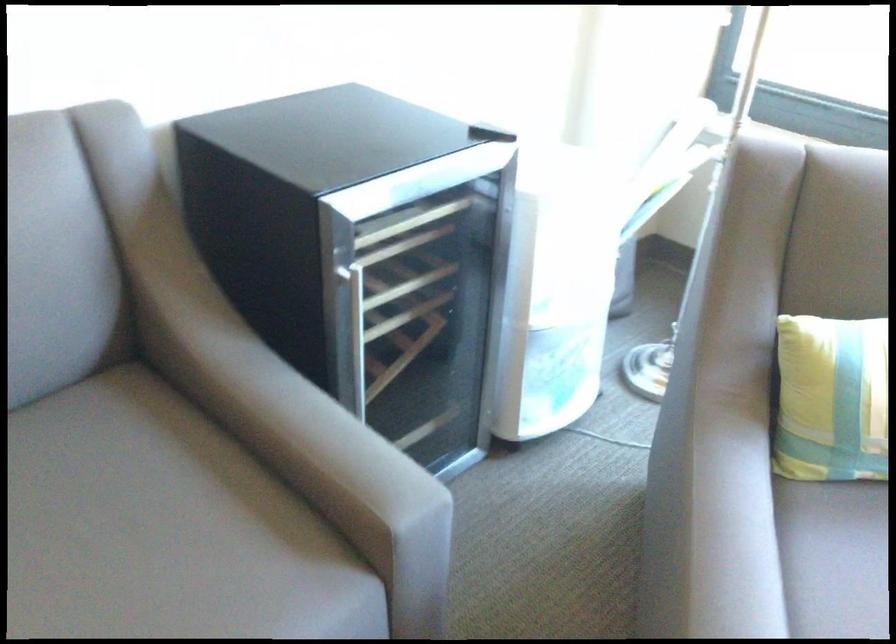
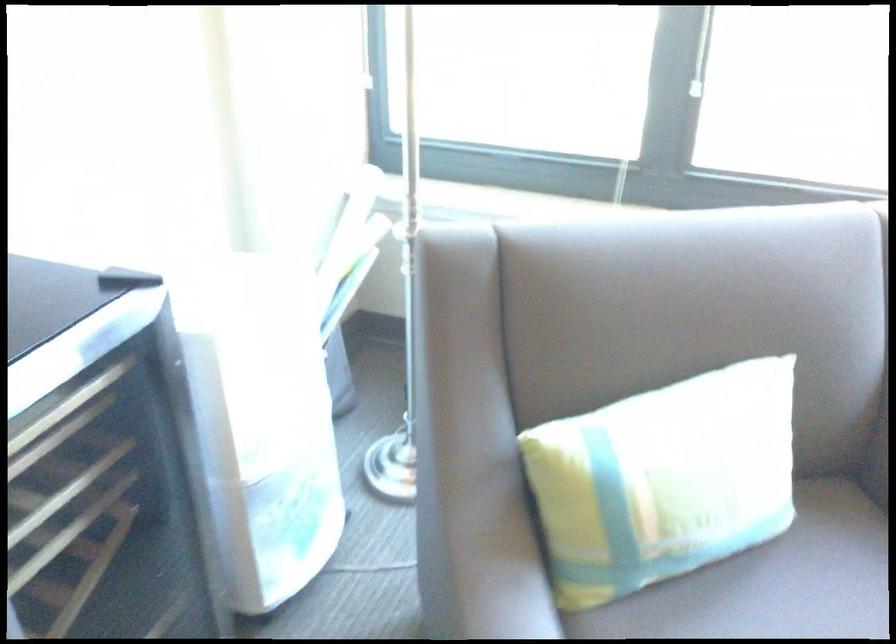
In a continuous first-person perspective shot, in which direction is the camera moving?

The movement direction of the cameraman is right, forward.